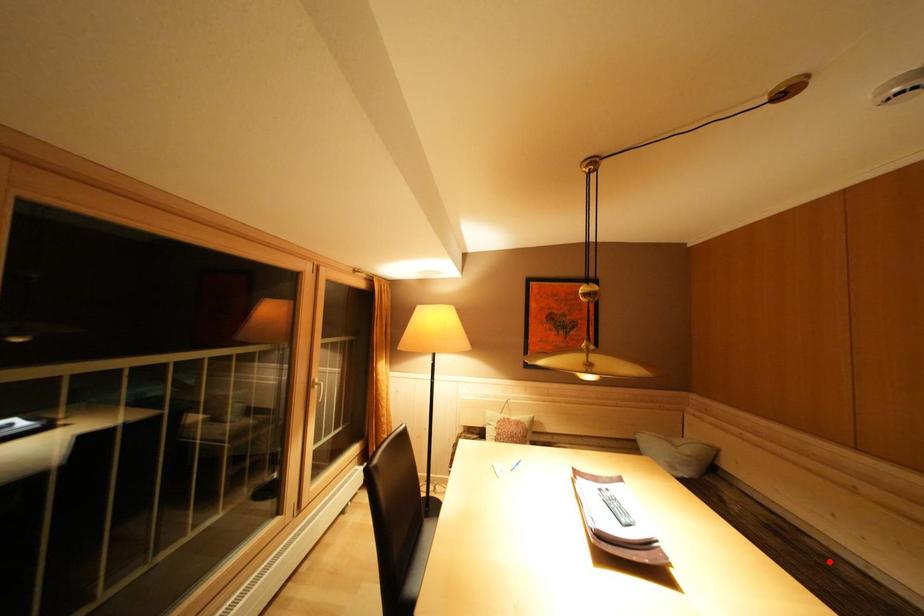
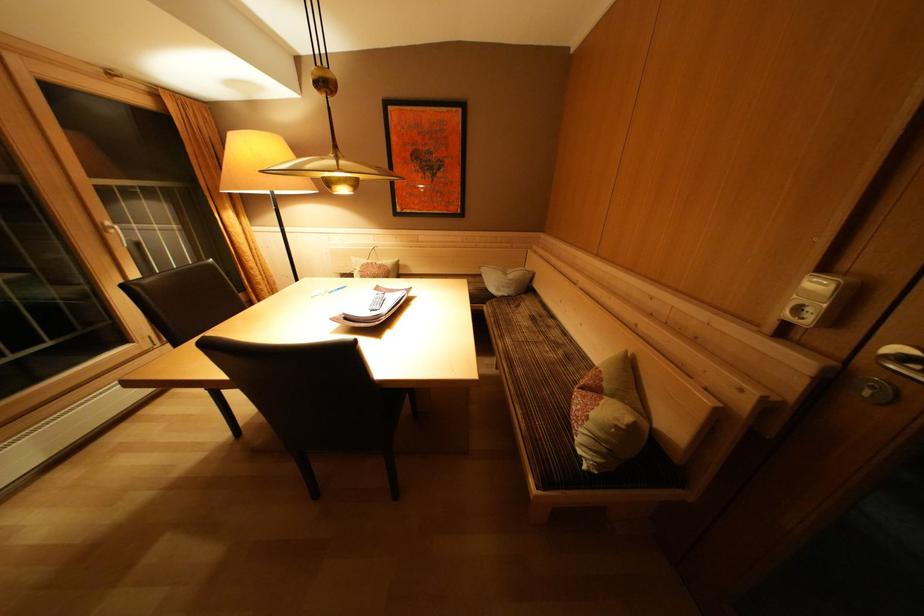
In the second image, find the point that corresponds to the highlighted location in the first image.

(555, 331)